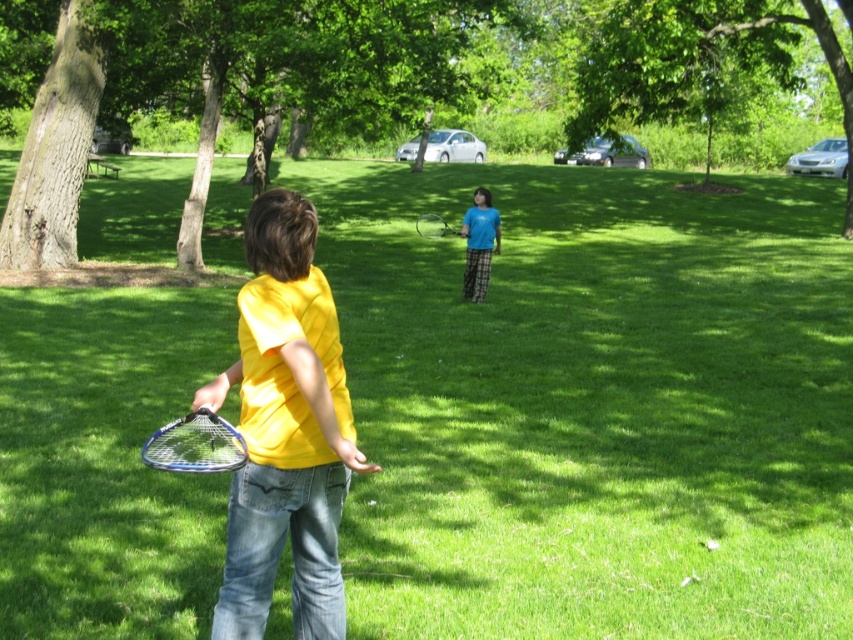
Is green leafy tree at center thinner than brown rough bark tree at left?

No, green leafy tree at center is not thinner than brown rough bark tree at left.

The image size is (853, 640). Describe the element at coordinates (381, 77) in the screenshot. I see `green leafy tree at center` at that location.

Between point (341, 99) and point (83, 26), which one is positioned behind?

Positioned behind is point (341, 99).

Find the location of a particular element. Image resolution: width=853 pixels, height=640 pixels. green leafy tree at center is located at coordinates (381, 77).

How far apart are green leafy tree at center and matte blue shirt at center?

green leafy tree at center and matte blue shirt at center are 21.21 meters apart from each other.

Locate an element on the screen. green leafy tree at center is located at coordinates (381, 77).

Find the location of a particular element. The height and width of the screenshot is (640, 853). green leafy tree at center is located at coordinates (381, 77).

Which is below, green leafy tree at upper center or matte blue shirt at center?

matte blue shirt at center is lower down.

Where is `green leafy tree at upper center`? This screenshot has height=640, width=853. green leafy tree at upper center is located at coordinates (677, 61).

This screenshot has height=640, width=853. What are the coordinates of `green leafy tree at upper center` in the screenshot? It's located at (677, 61).

The width and height of the screenshot is (853, 640). In order to click on green leafy tree at upper center in this screenshot , I will do `click(677, 61)`.